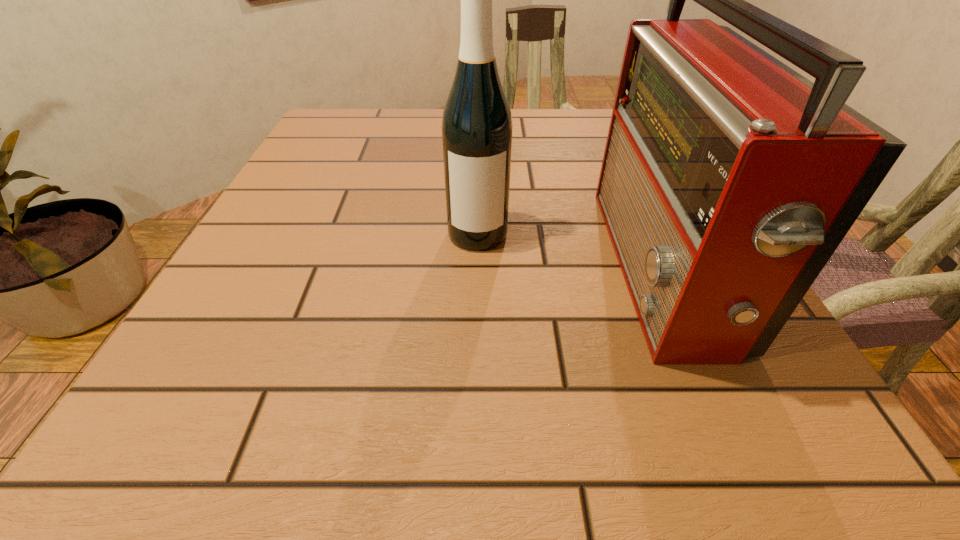
Identify the location of free region at the far left corner of the desktop. This screenshot has width=960, height=540. (365, 124).

This screenshot has width=960, height=540. In the image, there is a desktop. Identify the location of free space at the far right corner. (582, 113).

This screenshot has height=540, width=960. In the image, there is a desktop. Find the location of `free space at the near right corner`. free space at the near right corner is located at coordinates (839, 431).